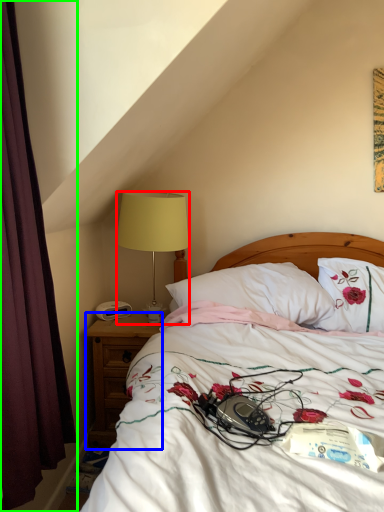
Question: Considering the real-world distances, which object is closest to lamp (highlighted by a red box)? nightstand (highlighted by a blue box) or curtain (highlighted by a green box).

Choices:
 (A) nightstand
 (B) curtain

Answer: (A)